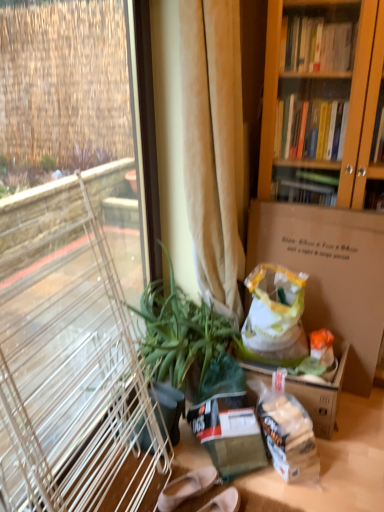
Question: Is the position of green matte plant at left more distant than that of matte beige shoes at lower center?

Choices:
 (A) no
 (B) yes

Answer: (A)

Question: Does green matte plant at left turn towards matte beige shoes at lower center?

Choices:
 (A) yes
 (B) no

Answer: (A)

Question: Is green matte plant at left to the right of matte beige shoes at lower center from the viewer's perspective?

Choices:
 (A) yes
 (B) no

Answer: (B)

Question: From the image's perspective, is green matte plant at left located beneath matte beige shoes at lower center?

Choices:
 (A) no
 (B) yes

Answer: (A)

Question: Considering the relative sizes of green matte plant at left and matte beige shoes at lower center in the image provided, is green matte plant at left wider than matte beige shoes at lower center?

Choices:
 (A) no
 (B) yes

Answer: (B)

Question: Does green matte plant at left have a smaller size compared to matte beige shoes at lower center?

Choices:
 (A) yes
 (B) no

Answer: (B)

Question: From the image's perspective, does beige fabric curtain at center appear higher than green matte plant at left?

Choices:
 (A) yes
 (B) no

Answer: (A)

Question: Considering the relative sizes of beige fabric curtain at center and green matte plant at left in the image provided, is beige fabric curtain at center smaller than green matte plant at left?

Choices:
 (A) no
 (B) yes

Answer: (B)

Question: Considering the relative sizes of beige fabric curtain at center and green matte plant at left in the image provided, is beige fabric curtain at center wider than green matte plant at left?

Choices:
 (A) no
 (B) yes

Answer: (A)

Question: Can you confirm if beige fabric curtain at center is positioned to the right of green matte plant at left?

Choices:
 (A) no
 (B) yes

Answer: (B)

Question: From a real-world perspective, is beige fabric curtain at center located beneath green matte plant at left?

Choices:
 (A) no
 (B) yes

Answer: (A)

Question: Is beige fabric curtain at center bigger than green matte plant at left?

Choices:
 (A) yes
 (B) no

Answer: (B)

Question: Does brown cardboard box at center-right appear on the left side of beige fabric curtain at center?

Choices:
 (A) no
 (B) yes

Answer: (A)